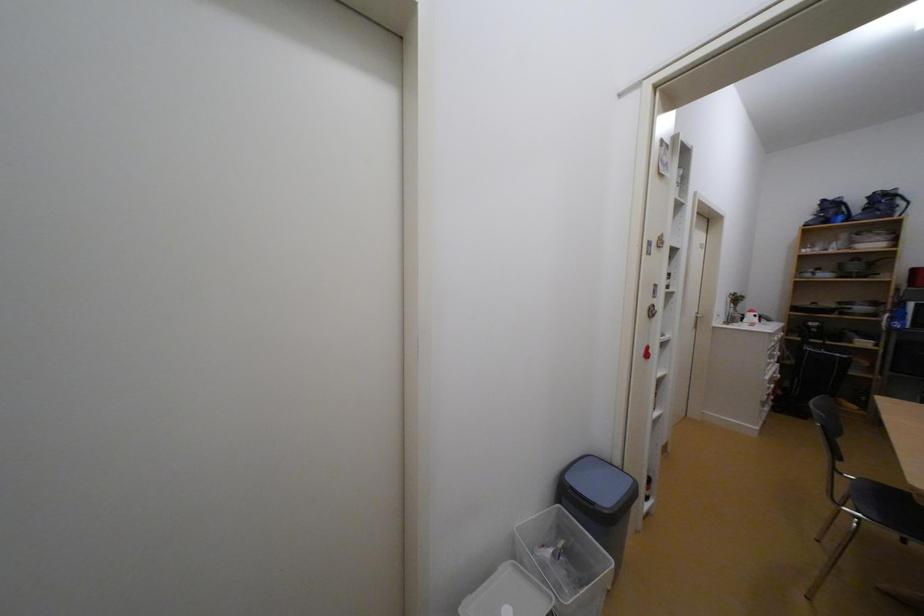
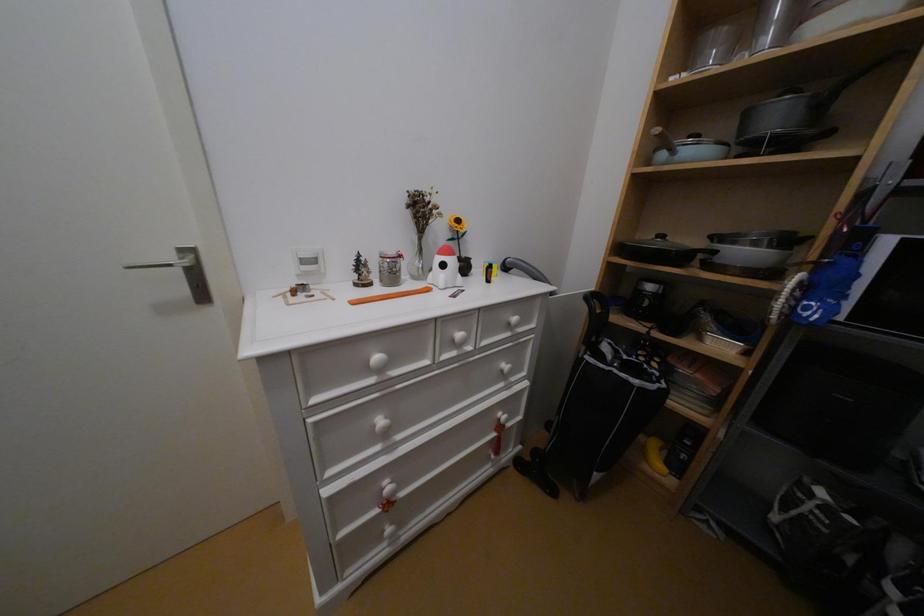
What movement of the cameraman would produce the second image?

The cameraman moved toward right, forward.